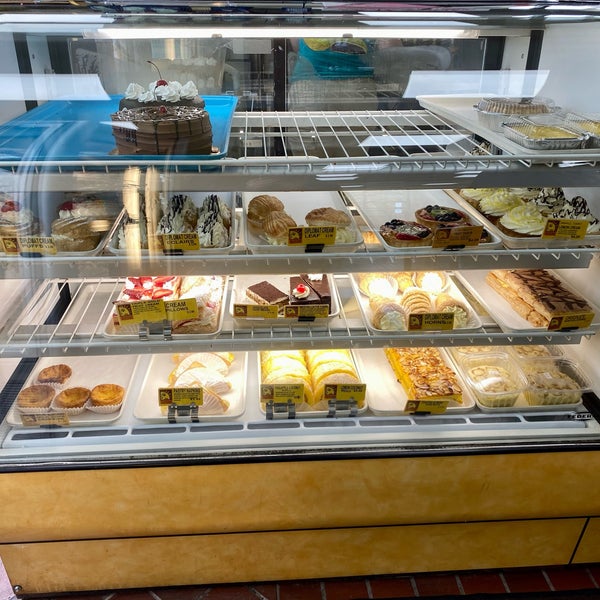
Find the location of a particular element. gray trays is located at coordinates (387, 211), (106, 372), (153, 402), (380, 383), (503, 315).